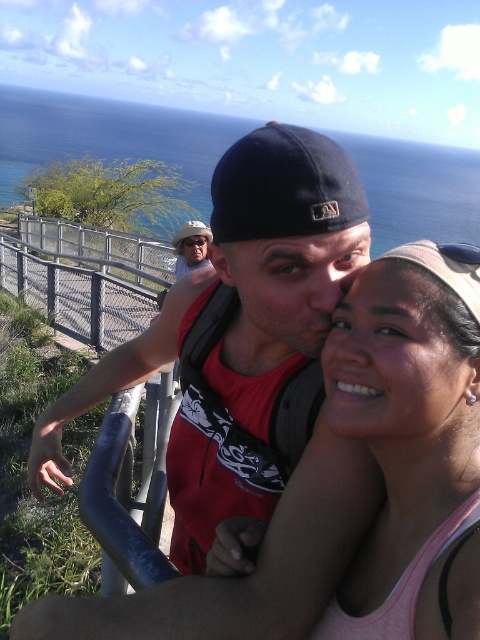
Question: From the image, what is the correct spatial relationship of matte red tank top at center in relation to pink fabric tank top at center?

Choices:
 (A) left
 (B) right

Answer: (A)

Question: Which point appears closest to the camera in this image?

Choices:
 (A) (211, 240)
 (B) (382, 612)
 (C) (308, 168)

Answer: (B)

Question: Is pink fabric tank top at center above matte black cap at upper center?

Choices:
 (A) no
 (B) yes

Answer: (A)

Question: Which object appears farthest from the camera in this image?

Choices:
 (A) matte black cap at upper center
 (B) pink fabric tank top at center
 (C) matte red tank top at center

Answer: (A)

Question: Which object appears farthest from the camera in this image?

Choices:
 (A) matte red tank top at center
 (B) pink fabric tank top at center

Answer: (A)

Question: Does matte red tank top at center come in front of matte black cap at upper center?

Choices:
 (A) yes
 (B) no

Answer: (A)